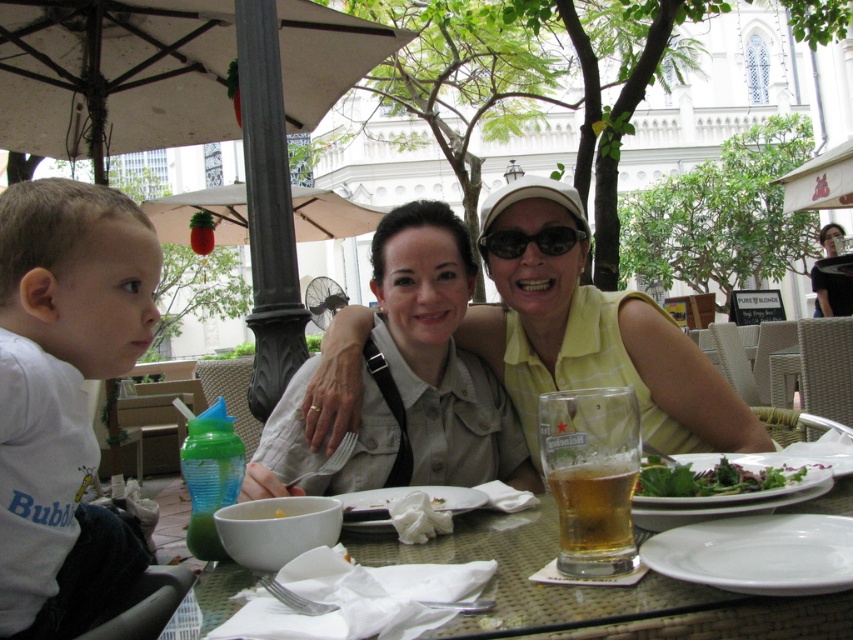
Can you confirm if clear glass table at center is smaller than green leafy salad at center?

Actually, clear glass table at center might be larger than green leafy salad at center.

From the picture: Does clear glass table at center appear on the left side of green leafy salad at center?

Indeed, clear glass table at center is positioned on the left side of green leafy salad at center.

What do you see at coordinates (592, 588) in the screenshot?
I see `clear glass table at center` at bounding box center [592, 588].

I want to click on clear glass table at center, so click(x=592, y=588).

Does matte yellow shirt at center have a larger size compared to green leafy salad at center?

Indeed, matte yellow shirt at center has a larger size compared to green leafy salad at center.

This screenshot has height=640, width=853. What are the coordinates of `matte yellow shirt at center` in the screenshot? It's located at (595, 336).

The image size is (853, 640). Identify the location of matte yellow shirt at center. (595, 336).

Who is positioned more to the left, light beige denim jacket at center or clear glass table at center?

light beige denim jacket at center is more to the left.

Based on the photo, does light beige denim jacket at center have a greater width compared to clear glass table at center?

No, light beige denim jacket at center is not wider than clear glass table at center.

This screenshot has width=853, height=640. What are the coordinates of `light beige denim jacket at center` in the screenshot? It's located at (409, 378).

Where is `light beige denim jacket at center`? Image resolution: width=853 pixels, height=640 pixels. light beige denim jacket at center is located at coordinates (409, 378).